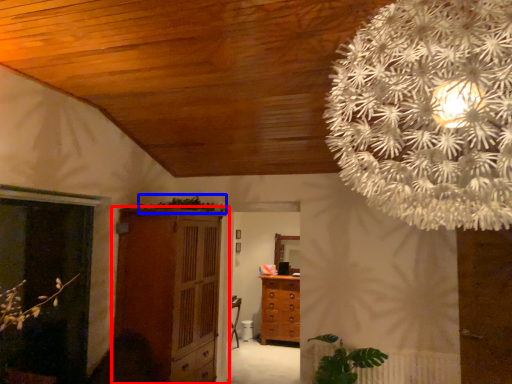
Question: Which object appears closest to the camera in this image, cupboard (highlighted by a red box) or plant (highlighted by a blue box)?

Choices:
 (A) cupboard
 (B) plant

Answer: (A)